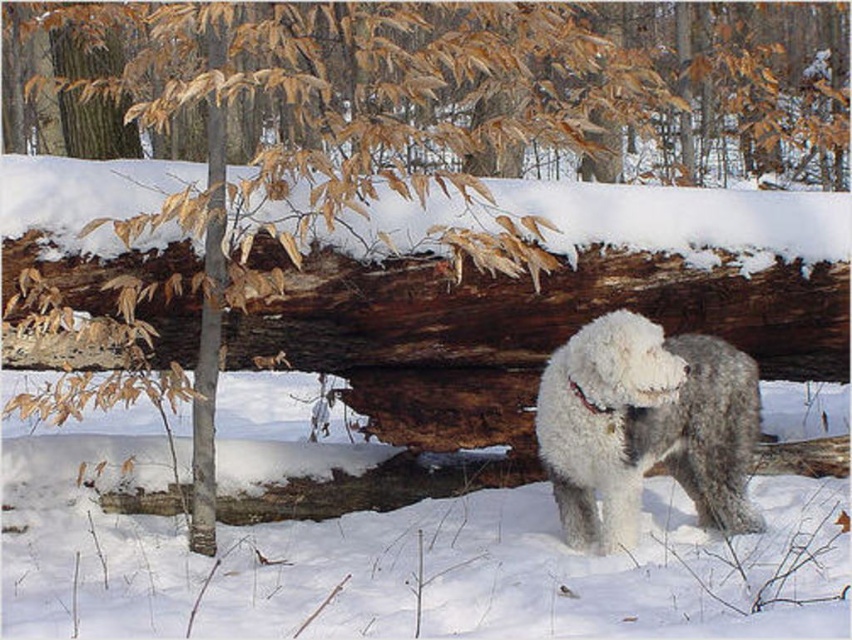
Between point (182, 333) and point (689, 385), which one is positioned in front?

Point (689, 385)

From the picture: Can you confirm if rough bark log at center is bigger than white fluffy dog at center?

Yes.

Measure the distance between rough bark log at center and camera.

rough bark log at center is 4.24 meters away from camera.

I want to click on rough bark log at center, so click(x=540, y=312).